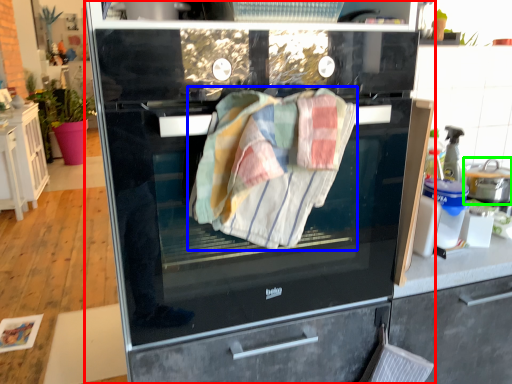
Question: Based on their relative distances, which object is nearer to home appliance (highlighted by a red box)? Choose from bath towel (highlighted by a blue box) and kitchen appliance (highlighted by a green box).

Choices:
 (A) bath towel
 (B) kitchen appliance

Answer: (A)